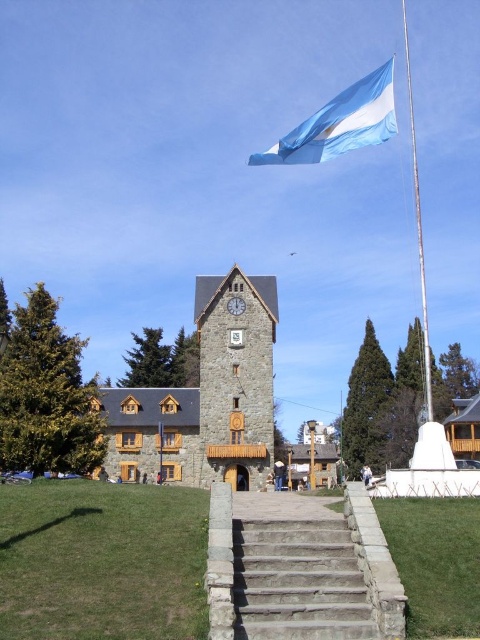
Does stone stairs at center have a larger size compared to white metallic flag pole at upper center?

No, stone stairs at center is not bigger than white metallic flag pole at upper center.

Is stone stairs at center below white metallic flag pole at upper center?

Correct, stone stairs at center is located below white metallic flag pole at upper center.

Who is more forward, (291, 596) or (410, 132)?

Point (291, 596) is more forward.

Find the location of a particular element. stone stairs at center is located at coordinates (298, 580).

Between stone clock tower at center and stone stairs at center, which one is positioned lower?

stone stairs at center

In the scene shown: Does stone clock tower at center have a lesser width compared to stone stairs at center?

In fact, stone clock tower at center might be wider than stone stairs at center.

What do you see at coordinates (236, 376) in the screenshot? The width and height of the screenshot is (480, 640). I see `stone clock tower at center` at bounding box center [236, 376].

Image resolution: width=480 pixels, height=640 pixels. Identify the location of stone clock tower at center. (236, 376).

Is blue fabric flag at upper center taller than white metallic flag pole at upper center?

In fact, blue fabric flag at upper center may be shorter than white metallic flag pole at upper center.

Can you confirm if blue fabric flag at upper center is positioned above white metallic flag pole at upper center?

Yes, blue fabric flag at upper center is above white metallic flag pole at upper center.

What do you see at coordinates (339, 124) in the screenshot? I see `blue fabric flag at upper center` at bounding box center [339, 124].

Identify the location of blue fabric flag at upper center. (339, 124).